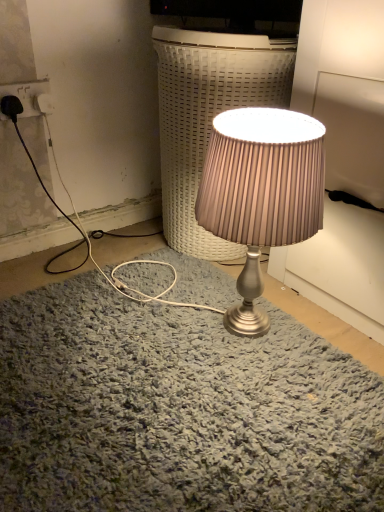
What is the approximate width of white plastic socket at upper left?

0.66 inches.

What do you see at coordinates (208, 115) in the screenshot?
I see `satin silver lamp at center` at bounding box center [208, 115].

Locate an element on the screen. satin silver lamp at center is located at coordinates (261, 193).

The height and width of the screenshot is (512, 384). What do you see at coordinates (261, 193) in the screenshot?
I see `satin silver lamp at center` at bounding box center [261, 193].

You are a GUI agent. You are given a task and a screenshot of the screen. Output one action in this format:
    pyautogui.click(x=<x>, y=<y>)
    Task: Click on the white plastic socket at upper left
    This screenshot has width=384, height=512.
    Given the screenshot: What is the action you would take?
    [x=31, y=97]

Can you confirm if white plastic socket at upper left is shorter than satin silver lamp at center?

Yes, white plastic socket at upper left is shorter than satin silver lamp at center.

Considering the relative positions of white plastic socket at upper left and satin silver lamp at center in the image provided, is white plastic socket at upper left to the left or to the right of satin silver lamp at center?

Based on their positions, white plastic socket at upper left is located to the left of satin silver lamp at center.

Are white plastic socket at upper left and satin silver lamp at center far apart?

They are positioned close to each other.

From the image's perspective, which is above, white plastic socket at upper left or satin silver lamp at center?

white plastic socket at upper left, from the image's perspective.

Can you tell me how much satin silver lamp at center and white plastic socket at upper left differ in facing direction?

The angle between the facing direction of satin silver lamp at center and the facing direction of white plastic socket at upper left is 92.1 degrees.

Considering the sizes of objects satin silver lamp at center and white plastic socket at upper left in the image provided, who is thinner, satin silver lamp at center or white plastic socket at upper left?

Thinner between the two is white plastic socket at upper left.

Consider the image. Considering the relative positions of satin silver lamp at center and white plastic socket at upper left in the image provided, is satin silver lamp at center to the left of white plastic socket at upper left from the viewer's perspective?

Incorrect, satin silver lamp at center is not on the left side of white plastic socket at upper left.

Does satin silver lamp at center touch white plastic socket at upper left?

No, satin silver lamp at center is not with white plastic socket at upper left.

Where is `electric outlet behind the satin silver lamp at center`? The image size is (384, 512). electric outlet behind the satin silver lamp at center is located at coordinates (31, 97).

Is white plastic socket at upper left at the back of satin silver lamp at center?

No, white plastic socket at upper left is not at the back of satin silver lamp at center.

Consider the image. Is satin silver lamp at center to the left or to the right of satin silver lamp at center in the image?

satin silver lamp at center is positioned on satin silver lamp at center's left side.

Is satin silver lamp at center further to camera compared to satin silver lamp at center?

Yes, it is behind satin silver lamp at center.

From a real-world perspective, is satin silver lamp at center over satin silver lamp at center?

Correct, in the physical world, satin silver lamp at center is higher than satin silver lamp at center.

Is point (210, 69) positioned behind point (260, 314)?

No, it is not.

Does satin silver lamp at center have a lesser height compared to satin silver lamp at center?

Correct, satin silver lamp at center is not as tall as satin silver lamp at center.

Identify the location of lamp on the right of the satin silver lamp at center. The height and width of the screenshot is (512, 384). (261, 193).

Considering the positions of objects satin silver lamp at center and satin silver lamp at center in the image provided, who is in front, satin silver lamp at center or satin silver lamp at center?

satin silver lamp at center is closer to the camera.

Considering the positions of points (215, 130) and (184, 60), is point (215, 130) closer to camera compared to point (184, 60)?

Yes, it is in front of point (184, 60).

From the image's perspective, would you say white plastic socket at upper left is shown under satin silver lamp at center?

Incorrect, from the image's perspective, white plastic socket at upper left is higher than satin silver lamp at center.

Is the position of white plastic socket at upper left more distant than that of satin silver lamp at center?

Yes, white plastic socket at upper left is behind satin silver lamp at center.

Considering the points (3, 85) and (225, 163), which point is in front, point (3, 85) or point (225, 163)?

Point (225, 163)

Does white plastic socket at upper left contain satin silver lamp at center?

Definitely not — satin silver lamp at center is not inside white plastic socket at upper left.

What are the coordinates of `electric outlet behind the satin silver lamp at center` in the screenshot? It's located at (31, 97).

The width and height of the screenshot is (384, 512). I want to click on electric outlet on the left of satin silver lamp at center, so click(x=31, y=97).

Looking at this image, estimate the real-world distances between objects in this image. Which object is further from satin silver lamp at center, white plastic socket at upper left or satin silver lamp at center?

white plastic socket at upper left lies further to satin silver lamp at center than the other object.

Based on their spatial positions, is satin silver lamp at center or satin silver lamp at center closer to white plastic socket at upper left?

Among the two, satin silver lamp at center is located nearer to white plastic socket at upper left.

Which object lies nearer to the anchor point satin silver lamp at center, satin silver lamp at center or white plastic socket at upper left?

satin silver lamp at center is positioned closer to the anchor satin silver lamp at center.

From the image, which object appears to be farther from satin silver lamp at center, white plastic socket at upper left or satin silver lamp at center?

white plastic socket at upper left lies further to satin silver lamp at center than the other object.

Consider the image. Estimate the real-world distances between objects in this image. Which object is closer to white plastic socket at upper left, satin silver lamp at center or satin silver lamp at center?

Based on the image, satin silver lamp at center appears to be nearer to white plastic socket at upper left.

Estimate the real-world distances between objects in this image. Which object is further from satin silver lamp at center, satin silver lamp at center or white plastic socket at upper left?

The object further to satin silver lamp at center is white plastic socket at upper left.

This screenshot has width=384, height=512. I want to click on table between white plastic socket at upper left and satin silver lamp at center, so click(208, 115).